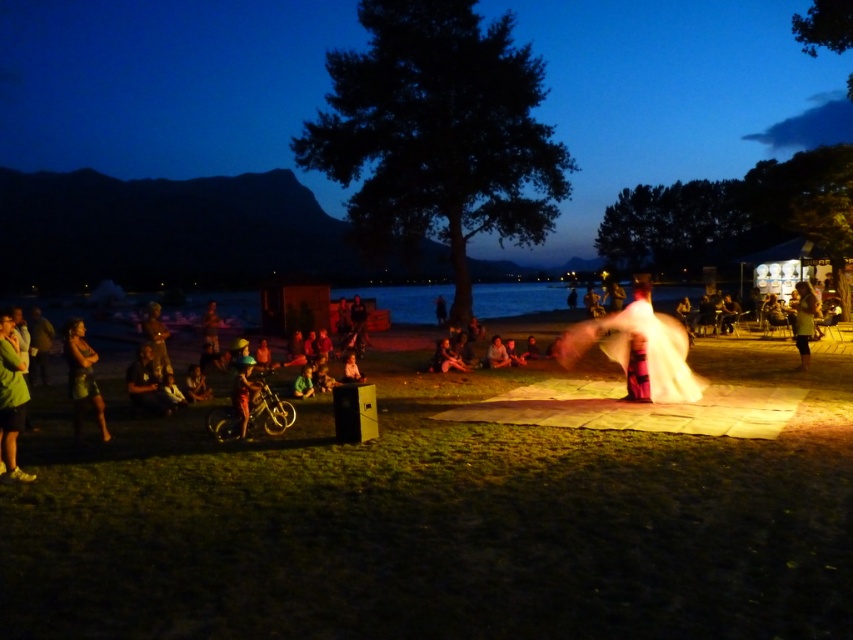
How far apart are green fabric jacket at lower left and smooth skin person at center?

8.80 meters

Does green fabric jacket at lower left appear under smooth skin person at center?

No.

The height and width of the screenshot is (640, 853). In order to click on green fabric jacket at lower left in this screenshot , I will do `click(10, 401)`.

Locate an element on the screen. The height and width of the screenshot is (640, 853). green fabric jacket at lower left is located at coordinates (10, 401).

Can you confirm if white cotton dress at right is taller than light brown leather jacket at center?

Correct, white cotton dress at right is much taller as light brown leather jacket at center.

Which is behind, point (814, 301) or point (489, 356)?

The point (489, 356) is more distant.

Where is `white cotton dress at right`? The height and width of the screenshot is (640, 853). white cotton dress at right is located at coordinates (804, 321).

Identify the location of white cotton dress at right. (804, 321).

Based on the photo, is white cotton fabric at center closer to the viewer compared to matte black bicycle at center?

Yes, white cotton fabric at center is closer to the viewer.

Can you confirm if white cotton fabric at center is wider than matte black bicycle at center?

No.

Image resolution: width=853 pixels, height=640 pixels. I want to click on white cotton fabric at center, so click(639, 348).